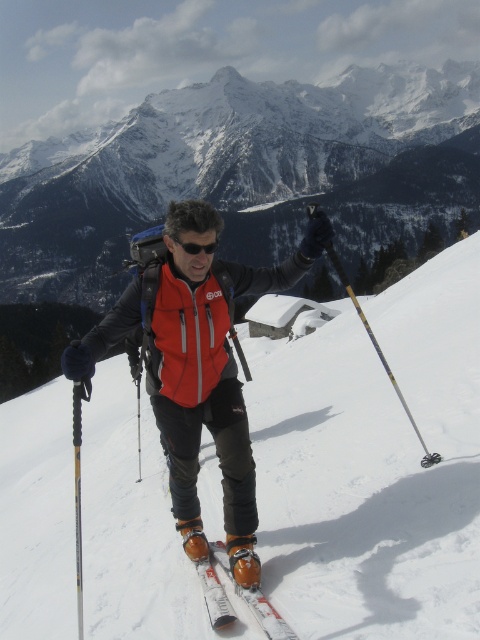
Which is in front, point (335, 572) or point (193, 250)?

Point (335, 572) is in front.

Is white snow ski slope at center shorter than black plastic goggles at center?

No.

Which is in front, point (20, 544) or point (216, 241)?

Point (216, 241)

This screenshot has height=640, width=480. Find the location of `white snow ski slope at center`. white snow ski slope at center is located at coordinates (373, 461).

Is orange softshell jacket at center smaller than black plastic goggles at center?

No.

Locate an element on the screen. The image size is (480, 640). orange softshell jacket at center is located at coordinates pyautogui.click(x=197, y=369).

Is point (324, 216) less distant than point (210, 250)?

That is False.

Image resolution: width=480 pixels, height=640 pixels. I want to click on orange softshell jacket at center, so click(x=197, y=369).

Is white snow ski slope at center to the right of orange softshell jacket at center from the viewer's perspective?

Correct, you'll find white snow ski slope at center to the right of orange softshell jacket at center.

Is white snow ski slope at center further to the viewer compared to orange softshell jacket at center?

That is False.

Is point (440, 404) less distant than point (197, 317)?

No, (440, 404) is further to viewer.

This screenshot has width=480, height=640. Find the location of `white snow ski slope at center`. white snow ski slope at center is located at coordinates (373, 461).